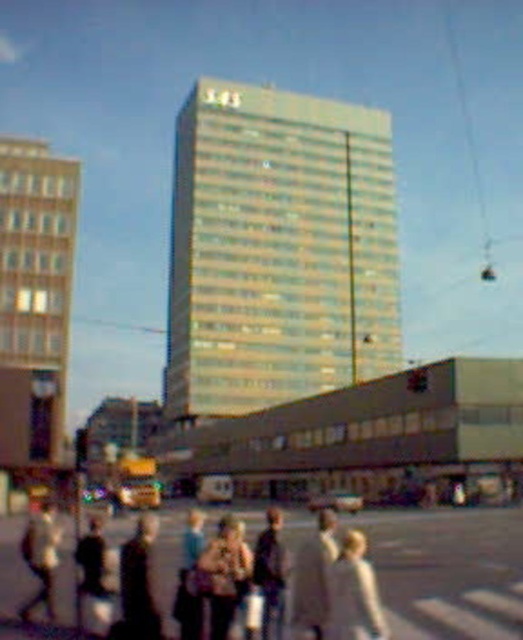
Which is behind, point (129, 577) or point (189, 552)?

The point (189, 552) is more distant.

Can you confirm if dark gray fabric jacket at lower center is thinner than light brown leather jacket at center?

In fact, dark gray fabric jacket at lower center might be wider than light brown leather jacket at center.

Is point (160, 637) positioned behind point (187, 548)?

No, it is not.

The image size is (523, 640). I want to click on dark gray fabric jacket at lower center, so click(139, 582).

Who is more forward, (224, 524) or (79, 628)?

Point (79, 628) is more forward.

Does light beige fabric bag at center have a larger size compared to dark gray sweater at lower left?

Incorrect, light beige fabric bag at center is not larger than dark gray sweater at lower left.

Identify the location of light beige fabric bag at center. (225, 573).

Does dark gray sweater at lower left appear under light brown leather jacket at center?

Incorrect, dark gray sweater at lower left is not positioned below light brown leather jacket at center.

Is dark gray sweater at lower left above light brown leather jacket at center?

Correct, dark gray sweater at lower left is located above light brown leather jacket at center.

Does point (94, 547) come behind point (202, 536)?

No, (94, 547) is closer to viewer.

What are the coordinates of `dark gray sweater at lower left` in the screenshot? It's located at (92, 577).